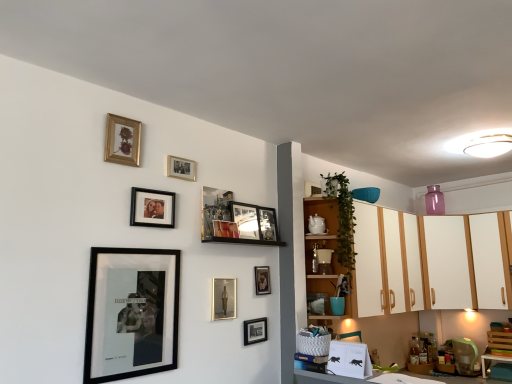
Question: Is the surface of wooden cabinet at upper right in direct contact with black matte picture frame at lower center, the 1th picture frame ordered from the bottom?

Choices:
 (A) yes
 (B) no

Answer: (B)

Question: Does wooden cabinet at upper right come in front of black matte picture frame at lower center, the eleventh picture frame from the top?

Choices:
 (A) yes
 (B) no

Answer: (B)

Question: Does wooden cabinet at upper right have a lesser height compared to black matte picture frame at lower center, the eleventh picture frame from the top?

Choices:
 (A) no
 (B) yes

Answer: (A)

Question: Does wooden cabinet at upper right have a lesser width compared to black matte picture frame at lower center, the 1th picture frame ordered from the bottom?

Choices:
 (A) yes
 (B) no

Answer: (B)

Question: From the image's perspective, is wooden cabinet at upper right below black matte picture frame at lower center, the eleventh picture frame from the top?

Choices:
 (A) yes
 (B) no

Answer: (B)

Question: In the image, is wooden cabinet at upper right positioned in front of or behind black matte picture frame at lower center, the eleventh picture frame from the top?

Choices:
 (A) behind
 (B) front

Answer: (A)

Question: From a real-world perspective, is wooden cabinet at upper right physically located above or below black matte picture frame at lower center, the eleventh picture frame from the top?

Choices:
 (A) below
 (B) above

Answer: (B)

Question: Is wooden cabinet at upper right wider or thinner than black matte picture frame at lower center, the eleventh picture frame from the top?

Choices:
 (A) thin
 (B) wide

Answer: (B)

Question: Is point (335, 235) closer or farther from the camera than point (257, 342)?

Choices:
 (A) closer
 (B) farther

Answer: (B)

Question: Is point (173, 266) closer or farther from the camera than point (227, 301)?

Choices:
 (A) closer
 (B) farther

Answer: (A)

Question: Is black matte picture frame at lower left, placed as the 9th picture frame when sorted from top to bottom, bigger or smaller than metallic silver portrait at center, marked as the tenth picture frame in a top-to-bottom arrangement?

Choices:
 (A) big
 (B) small

Answer: (A)

Question: Considering the positions of black matte picture frame at lower left, placed as the 9th picture frame when sorted from top to bottom, and metallic silver portrait at center, the second picture frame in the bottom-to-top sequence, in the image, is black matte picture frame at lower left, placed as the 9th picture frame when sorted from top to bottom, wider or thinner than metallic silver portrait at center, the second picture frame in the bottom-to-top sequence,?

Choices:
 (A) thin
 (B) wide

Answer: (B)

Question: From their relative heights in the image, would you say black matte picture frame at lower left, positioned as the 3th picture frame in bottom-to-top order, is taller or shorter than metallic silver portrait at center, the second picture frame in the bottom-to-top sequence?

Choices:
 (A) short
 (B) tall

Answer: (B)

Question: From the image's perspective, is wooden cabinet at upper right above or below black matte picture frame at lower left, placed as the 9th picture frame when sorted from top to bottom?

Choices:
 (A) above
 (B) below

Answer: (A)

Question: In the image, is wooden cabinet at upper right positioned in front of or behind black matte picture frame at lower left, placed as the 9th picture frame when sorted from top to bottom?

Choices:
 (A) front
 (B) behind

Answer: (B)